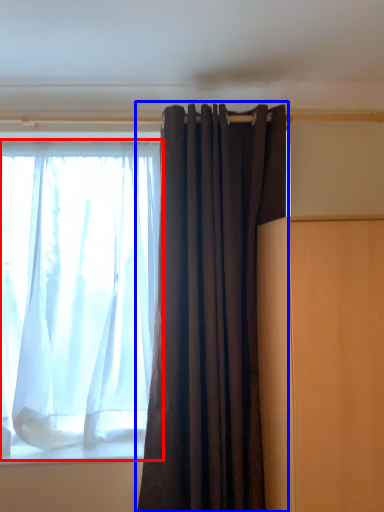
Question: Which point is closer to the camera, curtain (highlighted by a red box) or curtain (highlighted by a blue box)?

Choices:
 (A) curtain
 (B) curtain

Answer: (B)